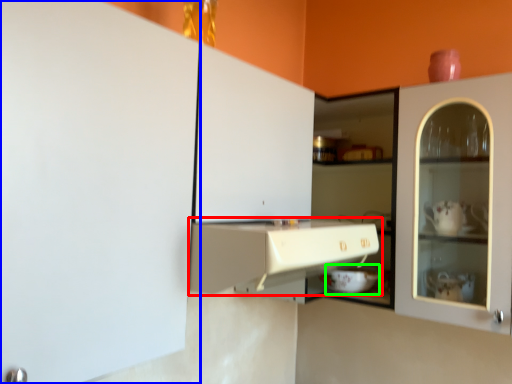
Question: Considering the real-world distances, which object is farthest from cabinetry (highlighted by a red box)? cabinetry (highlighted by a blue box) or appliance (highlighted by a green box)?

Choices:
 (A) cabinetry
 (B) appliance

Answer: (B)